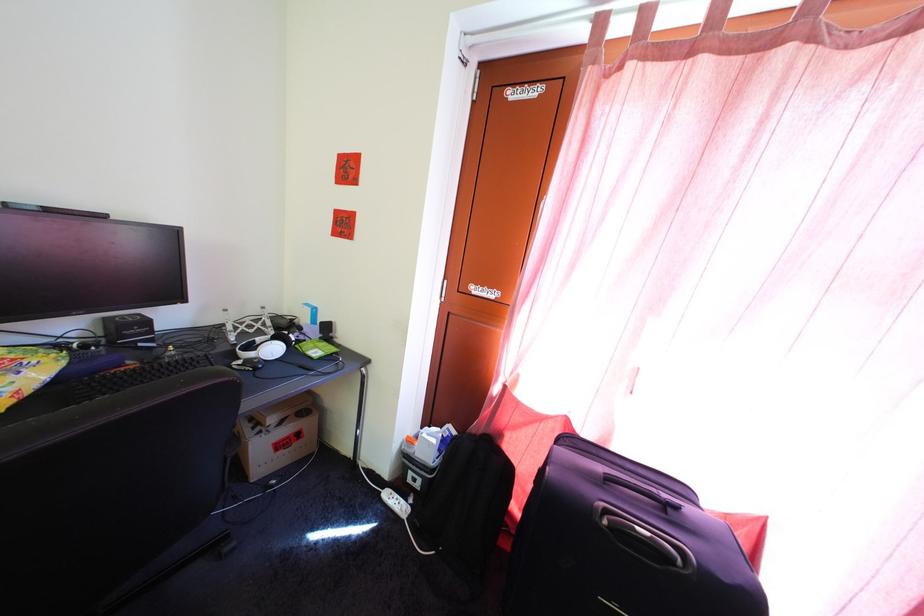
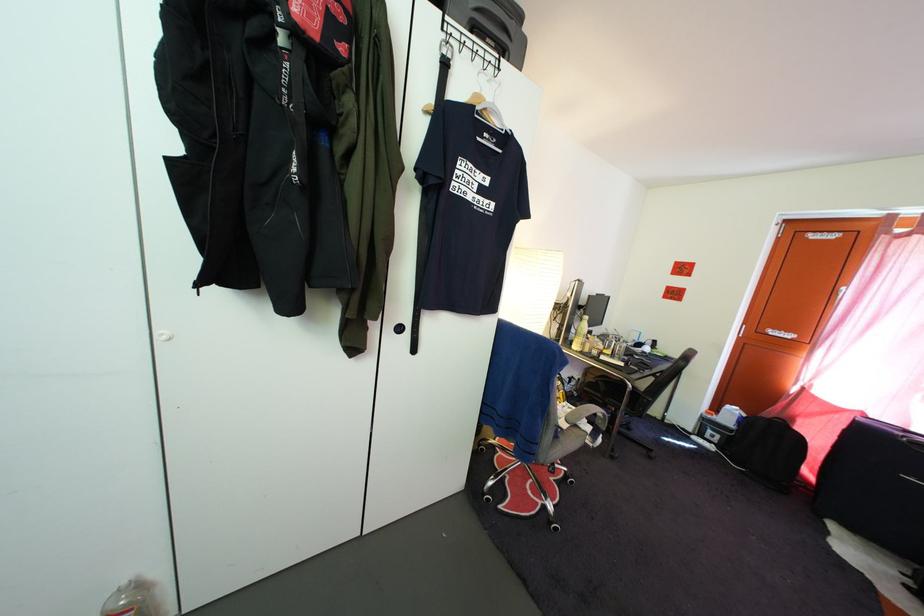
In the second image, find the point that corresponds to pixel 423 488 in the first image.

(721, 445)